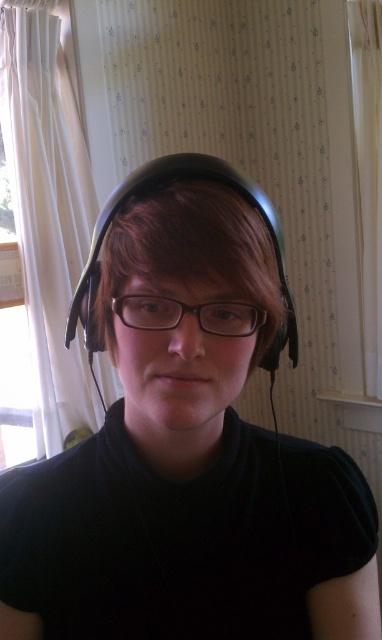
Question: Does white sheer curtain at left have a larger size compared to transparent plastic glasses at center?

Choices:
 (A) yes
 (B) no

Answer: (A)

Question: Is white sheer curtain at right above transparent plastic glasses at center?

Choices:
 (A) yes
 (B) no

Answer: (A)

Question: Based on their relative distances, which object is farther from the black matte headphones at center?

Choices:
 (A) white sheer curtain at left
 (B) white sheer curtain at right
 (C) transparent plastic glasses at center

Answer: (B)

Question: Considering the real-world distances, which object is closest to the transparent plastic glasses at center?

Choices:
 (A) white sheer curtain at right
 (B) white sheer curtain at left
 (C) black matte headphones at center

Answer: (C)

Question: Which object is closer to the camera taking this photo?

Choices:
 (A) black matte headphones at center
 (B) white sheer curtain at right

Answer: (A)

Question: From the image, what is the correct spatial relationship of black matte headphones at center in relation to white sheer curtain at right?

Choices:
 (A) left
 (B) right

Answer: (A)